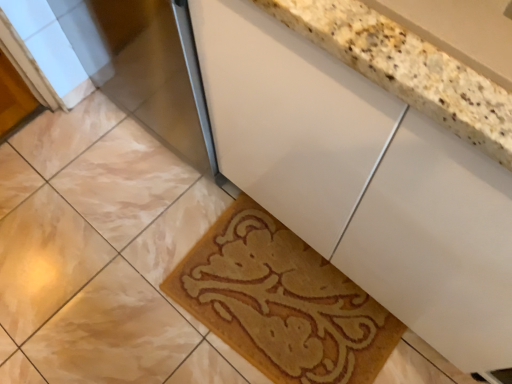
This screenshot has width=512, height=384. Identify the location of vacant region above beige textured bath mat at lower center (from a real-world perspective). (282, 301).